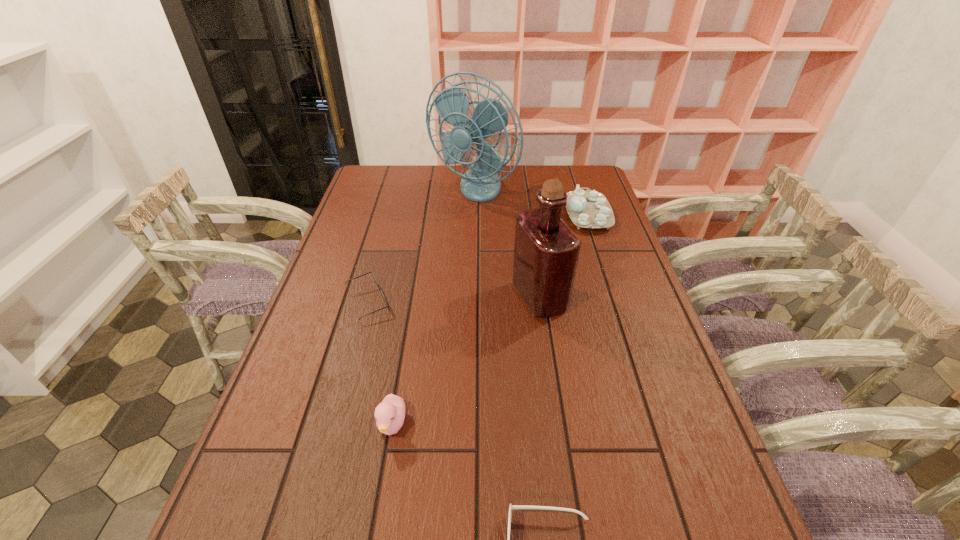
Find the location of a particular element. This screenshot has height=540, width=960. fan is located at coordinates (481, 183).

This screenshot has width=960, height=540. In order to click on liquor in this screenshot , I will do `click(546, 253)`.

Find the location of a particular element. the rightmost object is located at coordinates (590, 209).

Identify the location of the third tallest object. (590, 209).

Where is `the second nearest object`? the second nearest object is located at coordinates (390, 413).

Where is `the fourth tallest object`? This screenshot has width=960, height=540. the fourth tallest object is located at coordinates (390, 413).

The image size is (960, 540). Identify the location of spectacles. (380, 290).

At what (x,y) coordinates should I click in order to perform the action: click on free region located 0.110m in front of the tallest object to blow air. Please return your answer as a coordinate pair (x, y). Looking at the image, I should click on (472, 232).

Locate an element on the screen. blank space located on the left of the liquor is located at coordinates (451, 297).

At what (x,y) coordinates should I click in order to perform the action: click on free region located 0.070m on the front of the chinaware. Please return your answer as a coordinate pair (x, y). Image resolution: width=960 pixels, height=540 pixels. Looking at the image, I should click on point(599,247).